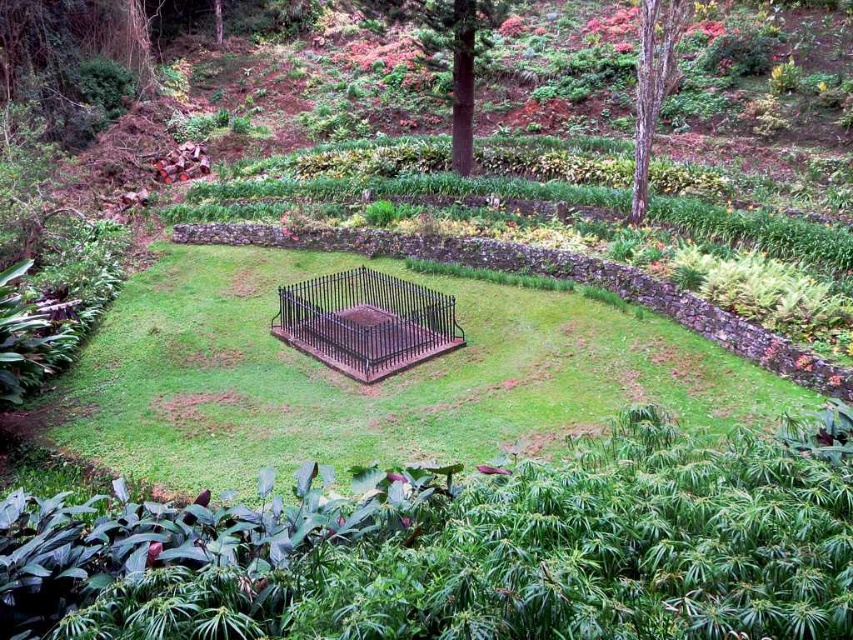
Question: Which object appears farthest from the camera in this image?

Choices:
 (A) brown smooth tree at upper center
 (B) black wrought iron bird cage at center
 (C) green grassy area at center
 (D) brown textured tree at upper right

Answer: (A)

Question: Does green grassy area at center have a lesser width compared to brown textured tree at upper right?

Choices:
 (A) yes
 (B) no

Answer: (B)

Question: Which is nearer to the green grassy area at center?

Choices:
 (A) green textured tree at upper center
 (B) black wrought iron bird cage at center
 (C) brown smooth tree at upper center
 (D) brown textured tree at upper right

Answer: (B)

Question: Does brown textured tree at upper right come behind green textured tree at upper center?

Choices:
 (A) no
 (B) yes

Answer: (A)

Question: Which object is the farthest from the brown textured tree at upper right?

Choices:
 (A) black wrought iron bird cage at center
 (B) brown smooth tree at upper center

Answer: (A)

Question: Does green leafy plants at lower center appear under black wrought iron bird cage at center?

Choices:
 (A) no
 (B) yes

Answer: (B)